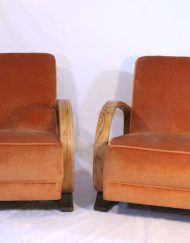
At what (x,y) coordinates should I click in order to perform the action: click on blue shadow aura rimming around chairs. Please return your answer as a coordinate pair (x, y). Looking at the image, I should click on (150, 55).